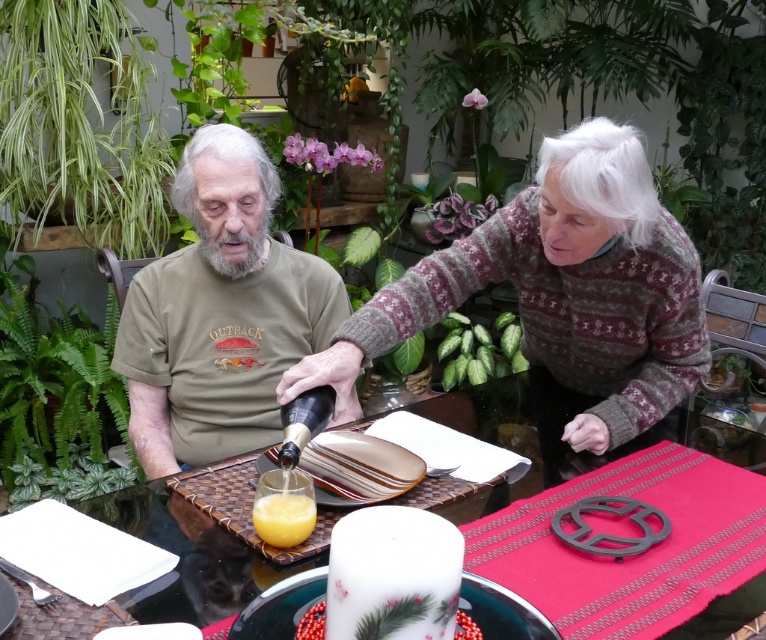
You are a guest at this outdoor dining event and want to reach for the translucent glass cup at center and the white glossy candle at center. Which object will your hand encounter first as you reach towards them?

The translucent glass cup at center is closer to you, so your hand will encounter it first before reaching the white glossy candle at center.

You are a guest at this outdoor dining event and want to place a small ornament between the green matte shirt at center and the translucent glass cup at center. Which object should you place it closer to if you want it to be closer to the taller object?

You should place the ornament closer to the green matte shirt at center because it is taller than the translucent glass cup at center.

You are a guest at this outdoor dining event and want to place a small decorative item between the green matte shirt at center and the translucent glass cup at center. Considering their sizes, which object should you place the item closer to to ensure it doesn

The green matte shirt at center is larger than the translucent glass cup at center, so placing the decorative item closer to the translucent glass cup at center would provide more balanced spacing between the two objects.